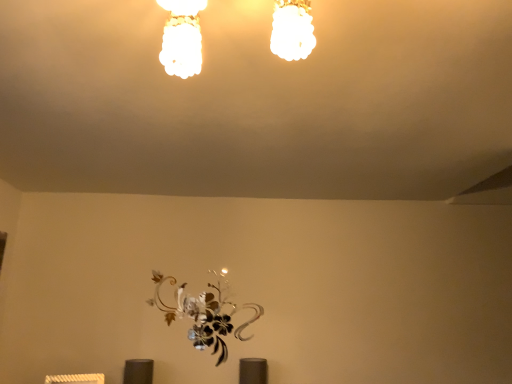
What do you see at coordinates (182, 38) in the screenshot? I see `matte glass chandelier at upper center` at bounding box center [182, 38].

In order to face matte glass chandelier at upper center, should I rotate leftwards or rightwards?

You should rotate left by 1.487 degrees.

Image resolution: width=512 pixels, height=384 pixels. I want to click on matte glass chandelier at upper center, so click(x=182, y=38).

What is the approximate width of matte glass chandelier at upper center?

matte glass chandelier at upper center is 12.04 inches in width.

Measure the distance between point (291, 10) and camera.

Point (291, 10) and camera are 32.32 inches apart from each other.

Identify the location of metallic silver flower at center. This screenshot has width=512, height=384. (205, 313).

What do you see at coordinates (205, 313) in the screenshot? Image resolution: width=512 pixels, height=384 pixels. I see `metallic silver flower at center` at bounding box center [205, 313].

The width and height of the screenshot is (512, 384). Identify the location of matte glass chandelier at upper center. 182,38.

Between metallic silver flower at center and matte glass chandelier at upper center, which one appears on the left side from the viewer's perspective?

From the viewer's perspective, metallic silver flower at center appears more on the left side.

Which is behind, metallic silver flower at center or matte glass chandelier at upper center?

metallic silver flower at center is more distant.

Is point (173, 284) more distant than point (198, 7)?

Yes, point (173, 284) is behind point (198, 7).

From the image's perspective, would you say metallic silver flower at center is shown under matte glass chandelier at upper center?

Correct, metallic silver flower at center appears lower than matte glass chandelier at upper center in the image.

From a real-world perspective, which is physically below, metallic silver flower at center or matte glass chandelier at upper center?

metallic silver flower at center is physically lower.

Considering the sizes of metallic silver flower at center and matte glass chandelier at upper center in the image, is metallic silver flower at center wider or thinner than matte glass chandelier at upper center?

metallic silver flower at center is thinner than matte glass chandelier at upper center.

Considering the sizes of objects metallic silver flower at center and matte glass chandelier at upper center in the image provided, who is shorter, metallic silver flower at center or matte glass chandelier at upper center?

matte glass chandelier at upper center is shorter.

Based on their sizes in the image, would you say metallic silver flower at center is bigger or smaller than matte glass chandelier at upper center?

Considering their sizes, metallic silver flower at center takes up less space than matte glass chandelier at upper center.

Is metallic silver flower at center surrounding matte glass chandelier at upper center?

That's incorrect, matte glass chandelier at upper center is not inside metallic silver flower at center.

Is metallic silver flower at center directly adjacent to matte glass chandelier at upper center?

No, metallic silver flower at center is not making contact with matte glass chandelier at upper center.

Is metallic silver flower at center turned away from matte glass chandelier at upper center?

No.

How far apart are metallic silver flower at center and matte glass chandelier at upper center?

A distance of 2.00 meters exists between metallic silver flower at center and matte glass chandelier at upper center.

This screenshot has width=512, height=384. In order to click on flower located underneath the matte glass chandelier at upper center (from a real-world perspective) in this screenshot , I will do `click(205, 313)`.

In the image, is matte glass chandelier at upper center on the left side or the right side of metallic silver flower at center?

From the image, it's evident that matte glass chandelier at upper center is to the right of metallic silver flower at center.

Relative to metallic silver flower at center, is matte glass chandelier at upper center in front or behind?

Visually, matte glass chandelier at upper center is located in front of metallic silver flower at center.

Which is behind, point (202, 8) or point (215, 349)?

The point (215, 349) is farther from the camera.

From the image's perspective, which object appears higher, matte glass chandelier at upper center or metallic silver flower at center?

From the image's view, matte glass chandelier at upper center is above.

From a real-world perspective, is matte glass chandelier at upper center below metallic silver flower at center?

Incorrect, from a real-world perspective, matte glass chandelier at upper center is higher than metallic silver flower at center.

Considering the relative sizes of matte glass chandelier at upper center and metallic silver flower at center in the image provided, is matte glass chandelier at upper center thinner than metallic silver flower at center?

No.

Does matte glass chandelier at upper center have a lesser height compared to metallic silver flower at center?

Yes, matte glass chandelier at upper center is shorter than metallic silver flower at center.

Considering the sizes of objects matte glass chandelier at upper center and metallic silver flower at center in the image provided, who is bigger, matte glass chandelier at upper center or metallic silver flower at center?

With larger size is matte glass chandelier at upper center.

Can metallic silver flower at center be found inside matte glass chandelier at upper center?

No.

Based on the photo, is matte glass chandelier at upper center touching metallic silver flower at center?

matte glass chandelier at upper center is not next to metallic silver flower at center, and they're not touching.

Is matte glass chandelier at upper center facing away from metallic silver flower at center?

Yes, matte glass chandelier at upper center's orientation is away from metallic silver flower at center.

Can you tell me how much matte glass chandelier at upper center and metallic silver flower at center differ in facing direction?

matte glass chandelier at upper center and metallic silver flower at center are facing 2.38 degrees away from each other.

How far apart are matte glass chandelier at upper center and metallic silver flower at center?

A distance of 6.55 feet exists between matte glass chandelier at upper center and metallic silver flower at center.

The image size is (512, 384). Find the location of `flower below the matte glass chandelier at upper center (from a real-world perspective)`. flower below the matte glass chandelier at upper center (from a real-world perspective) is located at coordinates (205, 313).

The image size is (512, 384). Find the location of `flower below the matte glass chandelier at upper center (from the image's perspective)`. flower below the matte glass chandelier at upper center (from the image's perspective) is located at coordinates (205, 313).

At what (x,y) coordinates should I click in order to perform the action: click on flower that is on the left side of matte glass chandelier at upper center. Please return your answer as a coordinate pair (x, y). This screenshot has height=384, width=512. Looking at the image, I should click on (205, 313).